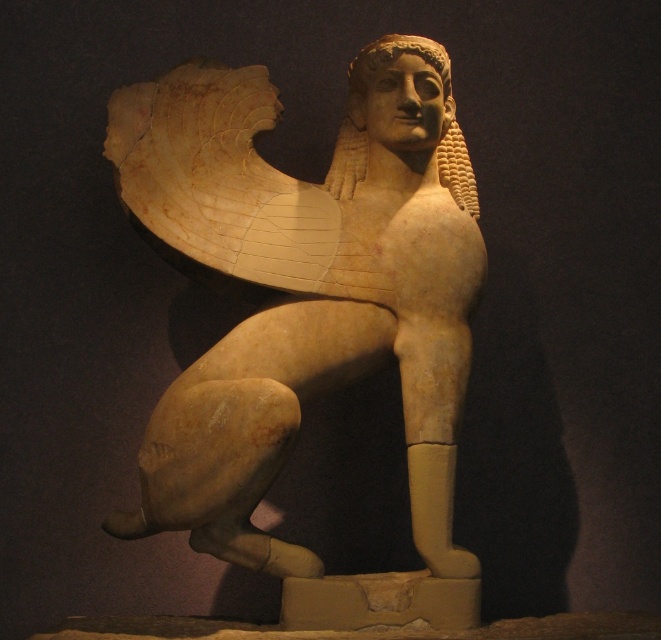
Who is more forward, [358,349] or [354,118]?

Point [358,349]

I want to click on beige stone sphinx at center, so click(x=303, y=288).